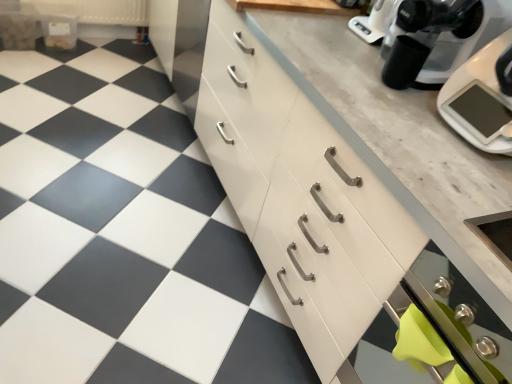
Question: Is black plastic coffee maker at upper right positioned behind stainless steel oven at lower right?

Choices:
 (A) no
 (B) yes

Answer: (B)

Question: Is black plastic coffee maker at upper right at the left side of stainless steel oven at lower right?

Choices:
 (A) yes
 (B) no

Answer: (A)

Question: From the image's perspective, does black plastic coffee maker at upper right appear higher than stainless steel oven at lower right?

Choices:
 (A) no
 (B) yes

Answer: (B)

Question: Is black plastic coffee maker at upper right to the right of stainless steel oven at lower right from the viewer's perspective?

Choices:
 (A) yes
 (B) no

Answer: (B)

Question: Does black plastic coffee maker at upper right lie in front of stainless steel oven at lower right?

Choices:
 (A) no
 (B) yes

Answer: (A)

Question: Is black plastic coffee maker at upper right facing away from stainless steel oven at lower right?

Choices:
 (A) no
 (B) yes

Answer: (A)

Question: Is white glossy tile at center aimed at black plastic coffee maker at upper right?

Choices:
 (A) no
 (B) yes

Answer: (A)

Question: Considering the relative positions of white glossy tile at center and black plastic coffee maker at upper right in the image provided, is white glossy tile at center behind black plastic coffee maker at upper right?

Choices:
 (A) yes
 (B) no

Answer: (B)

Question: Is white glossy tile at center to the right of black plastic coffee maker at upper right from the viewer's perspective?

Choices:
 (A) yes
 (B) no

Answer: (B)

Question: Is white glossy tile at center outside of black plastic coffee maker at upper right?

Choices:
 (A) no
 (B) yes

Answer: (B)

Question: Is white glossy tile at center beside black plastic coffee maker at upper right?

Choices:
 (A) no
 (B) yes

Answer: (A)

Question: From a real-world perspective, is white glossy tile at center below black plastic coffee maker at upper right?

Choices:
 (A) yes
 (B) no

Answer: (A)

Question: Is white wood cabinet at center, placed as the first cabinetry when sorted from front to back, turned away from white glossy tile at center?

Choices:
 (A) no
 (B) yes

Answer: (A)